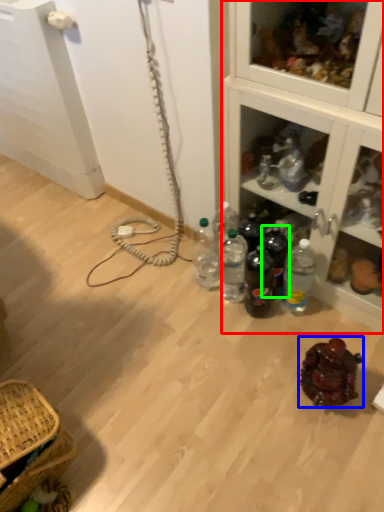
Question: Considering the real-world distances, which object is closest to cabinetry (highlighted by a red box)? food (highlighted by a blue box) or bottle (highlighted by a green box).

Choices:
 (A) food
 (B) bottle

Answer: (B)